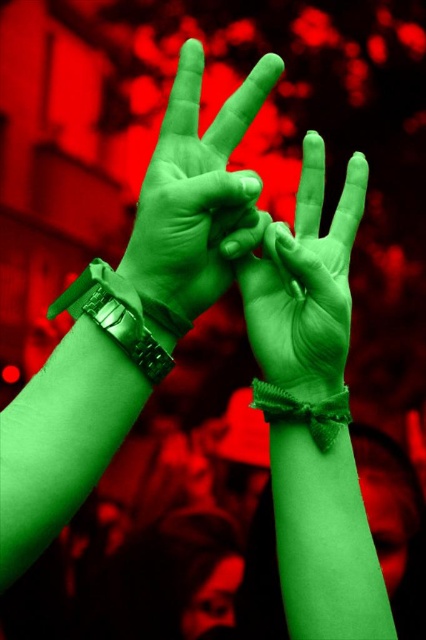
Is point (189, 240) farther from camera compared to point (347, 419)?

No, it is in front of (347, 419).

Does green rubber wristband at center lie in front of green knitted wristband at center?

Yes.

Does point (146, 221) lie in front of point (281, 392)?

Yes, it is in front of point (281, 392).

I want to click on green rubber wristband at center, so click(x=198, y=193).

Looking at this image, between green rubber glove at center and metallic green wristband at left, which one has less height?

metallic green wristband at left

Does point (310, 288) come closer to viewer compared to point (117, 333)?

No, it is behind (117, 333).

Locate an element on the screen. The width and height of the screenshot is (426, 640). green rubber glove at center is located at coordinates (305, 282).

Between point (152, 385) and point (255, 392), which one is positioned in front?

Point (152, 385) is more forward.

Consider the image. Does metallic green wristband at left have a lesser width compared to green knitted wristband at center?

No.

Does point (143, 301) lie behind point (322, 442)?

No, it is in front of (322, 442).

You are a GUI agent. You are given a task and a screenshot of the screen. Output one action in this format:
    pyautogui.click(x=<x>, y=<y>)
    Task: Click on the metallic green wristband at left
    The height and width of the screenshot is (640, 426).
    Given the screenshot: What is the action you would take?
    pyautogui.click(x=115, y=316)